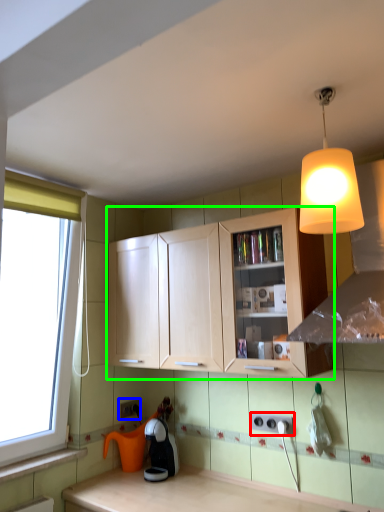
Question: Based on their relative distances, which object is farther from electric outlet (highlighted by a red box)? Choose from electric outlet (highlighted by a blue box) and cabinetry (highlighted by a green box).

Choices:
 (A) electric outlet
 (B) cabinetry

Answer: (A)